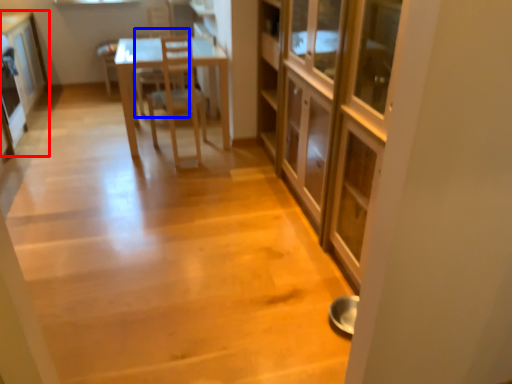
Question: Which of the following is the farthest to the observer, cabinetry (highlighted by a red box) or armchair (highlighted by a blue box)?

Choices:
 (A) cabinetry
 (B) armchair

Answer: (B)